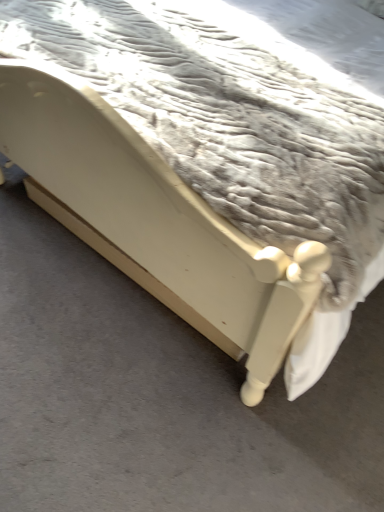
Identify the location of free point above matte white bedpost at lower center (from a real-world perspective). This screenshot has height=512, width=384. (112, 344).